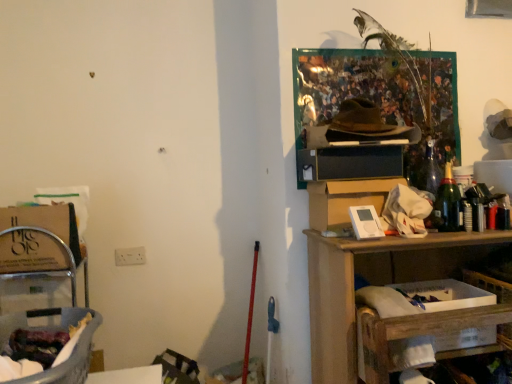
What do you see at coordinates (489, 285) in the screenshot?
I see `white cardboard box at lower right` at bounding box center [489, 285].

What do you see at coordinates (345, 200) in the screenshot? This screenshot has width=512, height=384. I see `white cardboard box at upper right, positioned as the first cardboard box in right-to-left order` at bounding box center [345, 200].

You are a GUI agent. You are given a task and a screenshot of the screen. Output one action in this format:
    pyautogui.click(x=<x>, y=<y>)
    Task: Click on the green glass bottle at right
    The image size is (512, 384).
    Given the screenshot: What is the action you would take?
    pyautogui.click(x=448, y=204)

This screenshot has height=384, width=512. What are the coordinates of `cardboard box that is the 2nd object located above the translucent plastic laundry basket at lower left (from the image's perspective)` in the screenshot? It's located at (345, 200).

Is translucent plastic laundry basket at lower left inside the boundaries of white cardboard box at upper right, positioned as the first cardboard box in right-to-left order, or outside?

translucent plastic laundry basket at lower left is not enclosed by white cardboard box at upper right, positioned as the first cardboard box in right-to-left order.

Is translucent plastic laundry basket at lower left positioned before white cardboard box at upper right, which is counted as the second cardboard box, starting from the left?

Yes, translucent plastic laundry basket at lower left is in front of white cardboard box at upper right, which is counted as the second cardboard box, starting from the left.

Considering the positions of objects white cardboard box at lower right and matte brown cardboard box at left, the 1th cardboard box viewed from the left, in the image provided, who is in front, white cardboard box at lower right or matte brown cardboard box at left, the 1th cardboard box viewed from the left,?

white cardboard box at lower right.

From a real-world perspective, is white cardboard box at lower right on top of matte brown cardboard box at left, the 1th cardboard box viewed from the left?

Incorrect, from a real-world perspective, white cardboard box at lower right is lower than matte brown cardboard box at left, the 1th cardboard box viewed from the left.

Can we say white cardboard box at lower right lies outside matte brown cardboard box at left, placed as the second cardboard box when sorted from right to left?

white cardboard box at lower right is positioned outside matte brown cardboard box at left, placed as the second cardboard box when sorted from right to left.

From the image's perspective, is white cardboard box at lower right below matte brown cardboard box at left, the 1th cardboard box viewed from the left?

Yes, from the image's perspective, white cardboard box at lower right is below matte brown cardboard box at left, the 1th cardboard box viewed from the left.

Consider the image. How distant is wooden shelf at right from translucent plastic laundry basket at lower left?

wooden shelf at right and translucent plastic laundry basket at lower left are 37.11 inches apart from each other.

Find the location of a particular element. The width and height of the screenshot is (512, 384). shelf lying below the translucent plastic laundry basket at lower left (from the image's perspective) is located at coordinates (353, 292).

Can translucent plastic laundry basket at lower left be found inside wooden shelf at right?

No, translucent plastic laundry basket at lower left is not surrounded by wooden shelf at right.

Considering the relative sizes of wooden shelf at right and translucent plastic laundry basket at lower left in the image provided, is wooden shelf at right thinner than translucent plastic laundry basket at lower left?

Yes, wooden shelf at right is thinner than translucent plastic laundry basket at lower left.

Measure the distance between matte brown cardboard box at left, the 1th cardboard box viewed from the left, and translucent plastic laundry basket at lower left.

matte brown cardboard box at left, the 1th cardboard box viewed from the left, is 12.18 inches from translucent plastic laundry basket at lower left.

Visually, is matte brown cardboard box at left, placed as the second cardboard box when sorted from right to left, positioned to the left or to the right of translucent plastic laundry basket at lower left?

matte brown cardboard box at left, placed as the second cardboard box when sorted from right to left, is to the left of translucent plastic laundry basket at lower left.

Which of these two, matte brown cardboard box at left, placed as the second cardboard box when sorted from right to left, or translucent plastic laundry basket at lower left, is wider?

translucent plastic laundry basket at lower left.

Could you tell me if matte brown cardboard box at left, placed as the second cardboard box when sorted from right to left, is turned towards translucent plastic laundry basket at lower left?

Yes, matte brown cardboard box at left, placed as the second cardboard box when sorted from right to left, is turned towards translucent plastic laundry basket at lower left.

Where is `basket on the right of white cardboard box at lower right`? The height and width of the screenshot is (384, 512). basket on the right of white cardboard box at lower right is located at coordinates (489, 285).

Which is more to the left, white cardboard box at lower right or white cardboard box at lower right?

From the viewer's perspective, white cardboard box at lower right appears more on the left side.

Which point is more forward, (453,342) or (511,347)?

The point (453,342) is closer to the camera.

Which cardboard box is the 1st one when counting from the left side of the green glass bottle at right? Please provide its 2D coordinates.

[(345, 200)]

Which object is thinner, green glass bottle at right or white cardboard box at upper right, positioned as the first cardboard box in right-to-left order?

Thinner between the two is green glass bottle at right.

In the image, is green glass bottle at right on the left side or the right side of white cardboard box at upper right, positioned as the first cardboard box in right-to-left order?

Based on their positions, green glass bottle at right is located to the right of white cardboard box at upper right, positioned as the first cardboard box in right-to-left order.

Does point (454, 182) come closer to viewer compared to point (321, 202)?

No, (454, 182) is behind (321, 202).

Is white cardboard box at lower right inside the boundaries of white cardboard box at upper right, which is counted as the second cardboard box, starting from the left, or outside?

The correct answer is: outside.

Are white cardboard box at lower right and white cardboard box at upper right, which is counted as the second cardboard box, starting from the left, far apart?

That's not correct — white cardboard box at lower right is a little close to white cardboard box at upper right, which is counted as the second cardboard box, starting from the left.

From the image's perspective, is white cardboard box at lower right on white cardboard box at upper right, positioned as the first cardboard box in right-to-left order?

No, from the image's perspective, white cardboard box at lower right is not over white cardboard box at upper right, positioned as the first cardboard box in right-to-left order.

Between white cardboard box at lower right and white cardboard box at upper right, which is counted as the second cardboard box, starting from the left, which one appears on the left side from the viewer's perspective?

white cardboard box at upper right, which is counted as the second cardboard box, starting from the left.

At what (x,y) coordinates should I click in order to perform the action: click on laundry basket in front of the white cardboard box at upper right, positioned as the first cardboard box in right-to-left order. Please return your answer as a coordinate pair (x, y). Image resolution: width=512 pixels, height=384 pixels. Looking at the image, I should click on click(x=51, y=330).

Find the location of a particular element. Image resolution: width=512 pixels, height=384 pixels. box beneath the matte brown cardboard box at left, the 1th cardboard box viewed from the left (from a real-world perspective) is located at coordinates (447, 294).

Estimate the real-world distances between objects in this image. Which object is closer to white cardboard box at lower right, white cardboard box at lower right or white cardboard box at upper right, positioned as the first cardboard box in right-to-left order?

white cardboard box at lower right.

From the image, which object appears to be farther from translucent plastic laundry basket at lower left, wooden shelf at right or green glass bottle at right?

green glass bottle at right.

Looking at the image, which one is located further to green glass bottle at right, matte brown cardboard box at left, placed as the second cardboard box when sorted from right to left, or white cardboard box at upper right, positioned as the first cardboard box in right-to-left order?

Among the two, matte brown cardboard box at left, placed as the second cardboard box when sorted from right to left, is located further to green glass bottle at right.

Which object lies nearer to the anchor point white cardboard box at lower right, translucent plastic laundry basket at lower left or wooden shelf at right?

Based on the image, wooden shelf at right appears to be nearer to white cardboard box at lower right.

Consider the image. Looking at the image, which one is located further to white cardboard box at upper right, positioned as the first cardboard box in right-to-left order, wooden shelf at right or white cardboard box at lower right?

→ white cardboard box at lower right is positioned further to the anchor white cardboard box at upper right, positioned as the first cardboard box in right-to-left order.

Based on their spatial positions, is translucent plastic laundry basket at lower left or white cardboard box at lower right further from white cardboard box at upper right, which is counted as the second cardboard box, starting from the left?

Based on the image, translucent plastic laundry basket at lower left appears to be further to white cardboard box at upper right, which is counted as the second cardboard box, starting from the left.

Which object lies nearer to the anchor point white cardboard box at upper right, which is counted as the second cardboard box, starting from the left, green glass bottle at right or matte brown cardboard box at left, placed as the second cardboard box when sorted from right to left?

Among the two, green glass bottle at right is located nearer to white cardboard box at upper right, which is counted as the second cardboard box, starting from the left.

Which object lies nearer to the anchor point white cardboard box at lower right, green glass bottle at right or white cardboard box at lower right?

white cardboard box at lower right.

You are a GUI agent. You are given a task and a screenshot of the screen. Output one action in this format:
    pyautogui.click(x=<x>, y=<y>)
    Task: Click on the laundry basket situated between matte brown cardboard box at left, placed as the second cardboard box when sorted from right to left, and green glass bottle at right from left to right
    The image size is (512, 384).
    Given the screenshot: What is the action you would take?
    pyautogui.click(x=51, y=330)

Identify the location of box between matte brown cardboard box at left, placed as the second cardboard box when sorted from right to left, and wooden shelf at right, in the horizontal direction. (447, 294).

Where is `cardboard box located between matte brown cardboard box at left, placed as the second cardboard box when sorted from right to left, and wooden shelf at right in the left-right direction`? cardboard box located between matte brown cardboard box at left, placed as the second cardboard box when sorted from right to left, and wooden shelf at right in the left-right direction is located at coordinates (345, 200).

The image size is (512, 384). I want to click on basket between green glass bottle at right and white cardboard box at lower right in the vertical direction, so click(x=489, y=285).